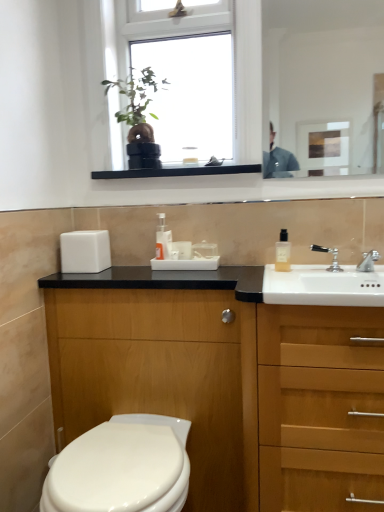
Question: Does wooden cabinet at right turn towards clear glass bottle at upper right, the 2th toiletry from the left?

Choices:
 (A) no
 (B) yes

Answer: (A)

Question: Is wooden cabinet at right taller than clear glass bottle at upper right, the second toiletry viewed from the back?

Choices:
 (A) yes
 (B) no

Answer: (A)

Question: Could clear glass bottle at upper right, the 2th toiletry from the left, be considered to be inside wooden cabinet at right?

Choices:
 (A) yes
 (B) no

Answer: (B)

Question: Does wooden cabinet at right have a lesser height compared to clear glass bottle at upper right, the second toiletry viewed from the back?

Choices:
 (A) yes
 (B) no

Answer: (B)

Question: From a real-world perspective, is wooden cabinet at right beneath clear glass bottle at upper right, the first toiletry when ordered from front to back?

Choices:
 (A) yes
 (B) no

Answer: (A)

Question: From a real-world perspective, relative to wooden cabinet at lower left, is silver metallic faucet at sink right, which is the second tap in right-to-left order, vertically above or below?

Choices:
 (A) below
 (B) above

Answer: (B)

Question: From the image's perspective, relative to wooden cabinet at lower left, is silver metallic faucet at sink right, placed as the 1th tap when sorted from left to right, above or below?

Choices:
 (A) below
 (B) above

Answer: (B)

Question: In the image, is silver metallic faucet at sink right, placed as the 1th tap when sorted from left to right, positioned in front of or behind wooden cabinet at lower left?

Choices:
 (A) behind
 (B) front

Answer: (A)

Question: Visually, is silver metallic faucet at sink right, which is the second tap in right-to-left order, positioned to the left or to the right of wooden cabinet at lower left?

Choices:
 (A) left
 (B) right

Answer: (B)

Question: From a real-world perspective, is clear glass bottle at upper right, the 2th toiletry from the left, above or below silver metallic faucet at sink right, placed as the 1th tap when sorted from left to right?

Choices:
 (A) below
 (B) above

Answer: (B)

Question: Considering the positions of clear glass bottle at upper right, acting as the first toiletry starting from the right, and silver metallic faucet at sink right, which is the second tap in right-to-left order, in the image, is clear glass bottle at upper right, acting as the first toiletry starting from the right, wider or thinner than silver metallic faucet at sink right, which is the second tap in right-to-left order,?

Choices:
 (A) wide
 (B) thin

Answer: (A)

Question: In terms of height, does clear glass bottle at upper right, the 2th toiletry from the left, look taller or shorter compared to silver metallic faucet at sink right, which is the second tap in right-to-left order?

Choices:
 (A) tall
 (B) short

Answer: (A)

Question: Is clear glass bottle at upper right, the first toiletry when ordered from front to back, to the left or to the right of silver metallic faucet at sink right, placed as the 1th tap when sorted from left to right, in the image?

Choices:
 (A) right
 (B) left

Answer: (B)

Question: Looking at their shapes, would you say wooden cabinet at right is wider or thinner than transparent glass window at upper center?

Choices:
 (A) wide
 (B) thin

Answer: (A)

Question: Do you think wooden cabinet at right is within transparent glass window at upper center, or outside of it?

Choices:
 (A) inside
 (B) outside

Answer: (B)